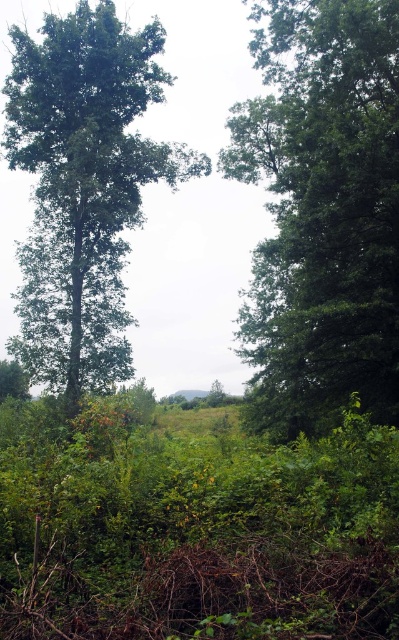
Consider the image. You are a hiker standing in the overgrown area and want to take a photo of both the green leafy tree at center and the green leafy tree at left. Which tree should you stand closer to in order to capture both in your camera frame?

To capture both the green leafy tree at center and the green leafy tree at left in your camera frame, you should stand closer to the green leafy tree at left. Since the green leafy tree at center is positioned over the green leafy tree at left, adjusting your position closer to the left tree will help include both in the frame without one blocking the other.

You are standing in the overgrown area and want to place a small garden ornament. You have two points marked as potential locations. The first point is at coordinate point (x=357, y=273) and the second is at point (x=27, y=282). Which point is closer to you where you can easily access it without moving too far?

Point (x=357, y=273) is closer to the viewer than point (x=27, y=282), so you can easily access it without moving too far.